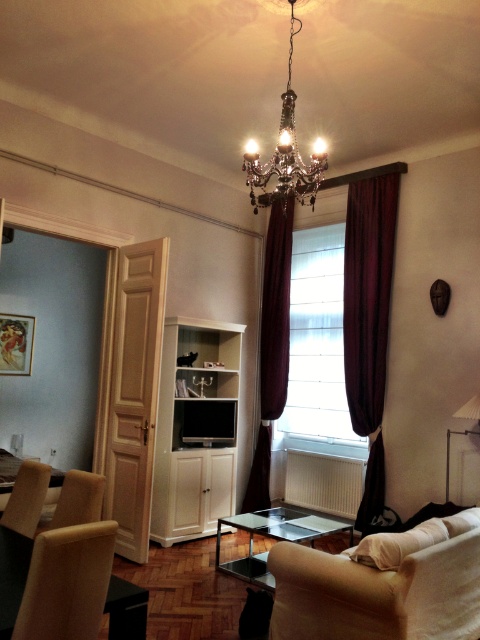
Does point (266, 474) come in front of point (2, 621)?

No, it is behind (2, 621).

Which is in front, point (265, 368) or point (140, 637)?

Point (140, 637)

You are a GUI agent. You are given a task and a screenshot of the screen. Output one action in this format:
    pyautogui.click(x=<x>, y=<y>)
    Task: Click on the velvet dark red curtain at center
    The image size is (480, 640).
    Given the screenshot: What is the action you would take?
    pyautogui.click(x=272, y=348)

Is point (375, 292) positioned in front of point (326, 298)?

Yes, it is.

Is point (355, 305) farther from viewer compared to point (296, 253)?

No, it is in front of (296, 253).

Which is in front, point (348, 356) or point (326, 308)?

Point (348, 356) is more forward.

This screenshot has width=480, height=640. What are the coordinates of `velvet dark red curtain at right` in the screenshot? It's located at (369, 323).

Between point (320, 435) and point (83, 513), which one is positioned behind?

Point (320, 435)

Which is more to the left, velvet curtains at center or matte brown chair at lower left?

Positioned to the left is matte brown chair at lower left.

The width and height of the screenshot is (480, 640). What do you see at coordinates (317, 339) in the screenshot?
I see `velvet curtains at center` at bounding box center [317, 339].

Find the location of a particular element. velvet curtains at center is located at coordinates (317, 339).